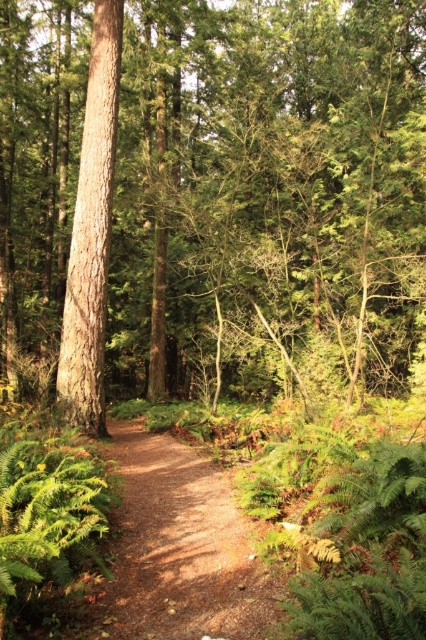
Does brown rough tree at center appear over brown dirt path at center?

Yes.

Is point (127, 182) more distant than point (189, 588)?

Yes, point (127, 182) is behind point (189, 588).

Locate an element on the screen. Image resolution: width=426 pixels, height=640 pixels. brown rough tree at center is located at coordinates (210, 196).

Does brown rough tree at center have a lesser height compared to smooth brown tree trunk at center?

No, brown rough tree at center is not shorter than smooth brown tree trunk at center.

Between point (382, 88) and point (91, 348), which one is positioned in front?

Positioned in front is point (91, 348).

Which is in front, point (166, 374) or point (103, 156)?

Point (103, 156) is more forward.

You are a GUI agent. You are given a task and a screenshot of the screen. Output one action in this format:
    pyautogui.click(x=<x>, y=<y>)
    Task: Click on the brown rough tree at center
    
    Given the screenshot: What is the action you would take?
    pyautogui.click(x=210, y=196)

Does brown dirt path at center appear on the right side of smooth brown tree trunk at center?

Yes, brown dirt path at center is to the right of smooth brown tree trunk at center.

Find the location of `brown dirt path at center`. brown dirt path at center is located at coordinates (180, 550).

Which is behind, point (215, 621) or point (106, 298)?

The point (106, 298) is more distant.

You are a GUI agent. You are given a task and a screenshot of the screen. Output one action in this format:
    pyautogui.click(x=<x>, y=<y>)
    Task: Click on the brown dirt path at center
    
    Given the screenshot: What is the action you would take?
    pyautogui.click(x=180, y=550)